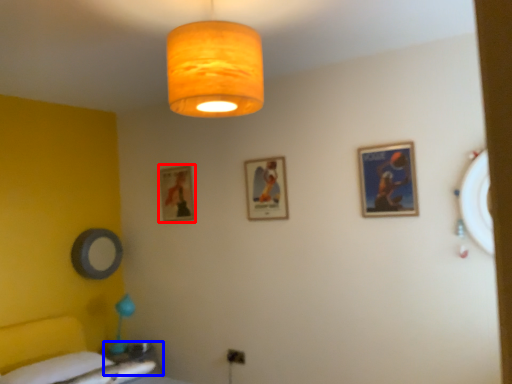
Question: Which point is further to the camera, picture frame (highlighted by a red box) or table (highlighted by a blue box)?

Choices:
 (A) picture frame
 (B) table

Answer: (A)